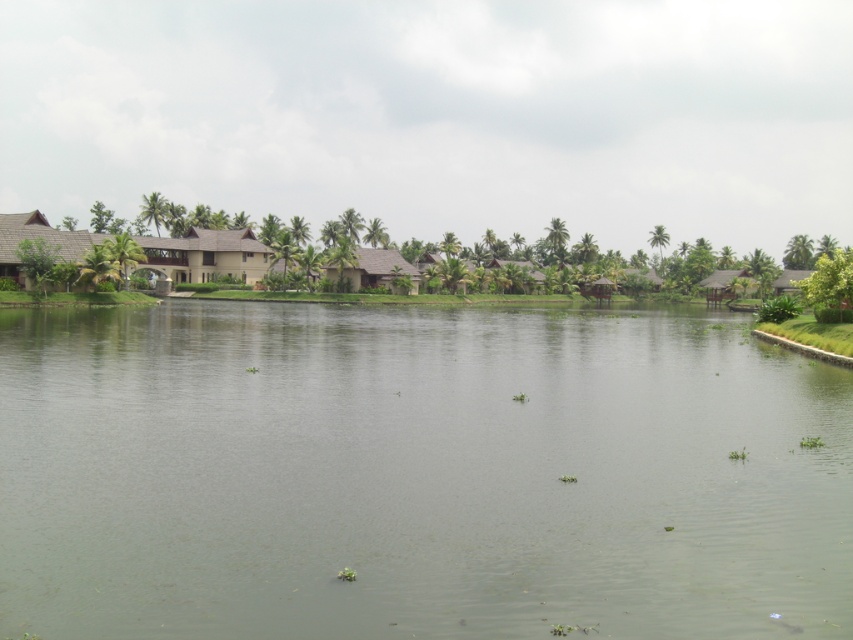
Question: Is green water at center to the left of brown thatched hut at center from the viewer's perspective?

Choices:
 (A) yes
 (B) no

Answer: (B)

Question: Is green water at center to the right of brown thatched hut at center from the viewer's perspective?

Choices:
 (A) no
 (B) yes

Answer: (B)

Question: Which point is farther to the camera?

Choices:
 (A) (357, 266)
 (B) (757, 497)

Answer: (A)

Question: Is green water at center in front of brown thatched hut at center?

Choices:
 (A) yes
 (B) no

Answer: (A)

Question: Which point is farther to the camera?

Choices:
 (A) brown thatched hut at center
 (B) green water at center

Answer: (A)

Question: Among these objects, which one is nearest to the camera?

Choices:
 (A) green water at center
 (B) brown thatched hut at center

Answer: (A)